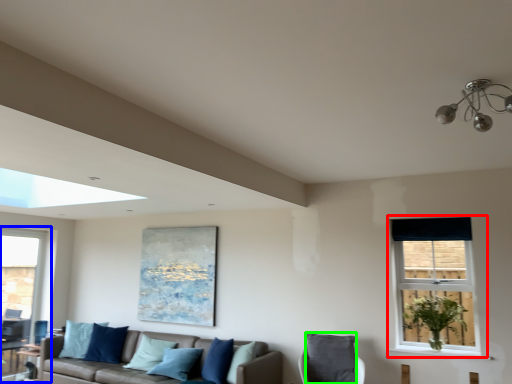
Question: Which is farther away from window (highlighted by a red box)? window (highlighted by a blue box) or pillow (highlighted by a green box)?

Choices:
 (A) window
 (B) pillow

Answer: (A)